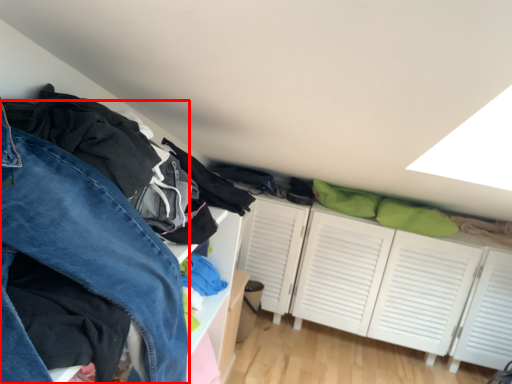
Question: From the image's perspective, where is trousers (annotated by the red box) located relative to dresser?

Choices:
 (A) below
 (B) above

Answer: (A)